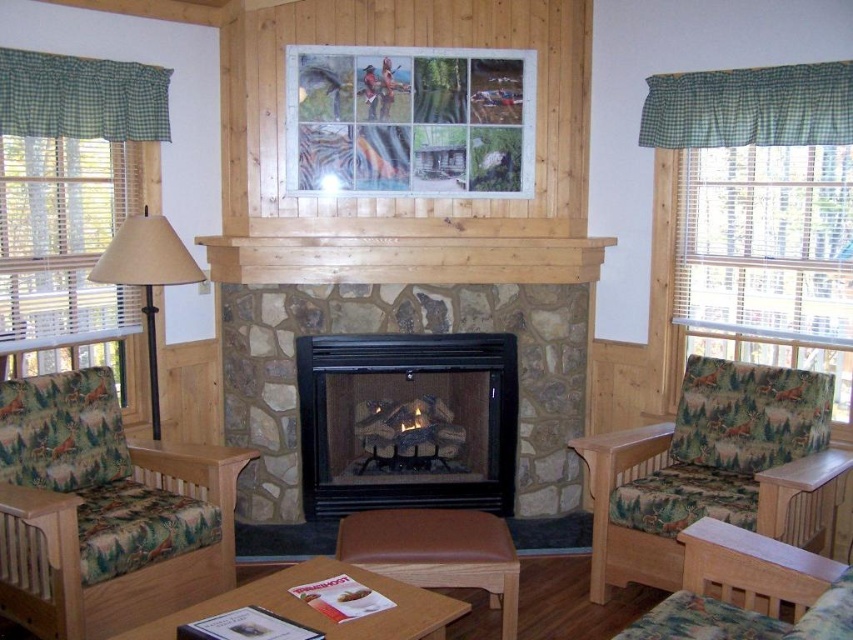
Measure the distance between black stone fireplace at center and camera.

They are 11.89 feet apart.

Can you confirm if black stone fireplace at center is bigger than patterned fabric armchair at lower right?

Yes, black stone fireplace at center is bigger than patterned fabric armchair at lower right.

Is point (494, 476) farther from viewer compared to point (811, 636)?

Yes, point (494, 476) is farther from viewer.

This screenshot has height=640, width=853. I want to click on black stone fireplace at center, so click(x=407, y=420).

Between leather ottoman at center and wooden coffee table at center, which one is positioned lower?

wooden coffee table at center

Identify the location of leather ottoman at center. (437, 552).

You are a GUI agent. You are given a task and a screenshot of the screen. Output one action in this format:
    pyautogui.click(x=<x>, y=<y>)
    Task: Click on the leather ottoman at center
    The image size is (853, 640).
    Given the screenshot: What is the action you would take?
    pyautogui.click(x=437, y=552)

Can you confirm if patterned fabric couch at right is wider than beige fabric lampshade at left?

Indeed, patterned fabric couch at right has a greater width compared to beige fabric lampshade at left.

I want to click on patterned fabric couch at right, so click(712, 468).

You are a GUI agent. You are given a task and a screenshot of the screen. Output one action in this format:
    pyautogui.click(x=<x>, y=<y>)
    Task: Click on the patterned fabric couch at right
    
    Given the screenshot: What is the action you would take?
    pyautogui.click(x=712, y=468)